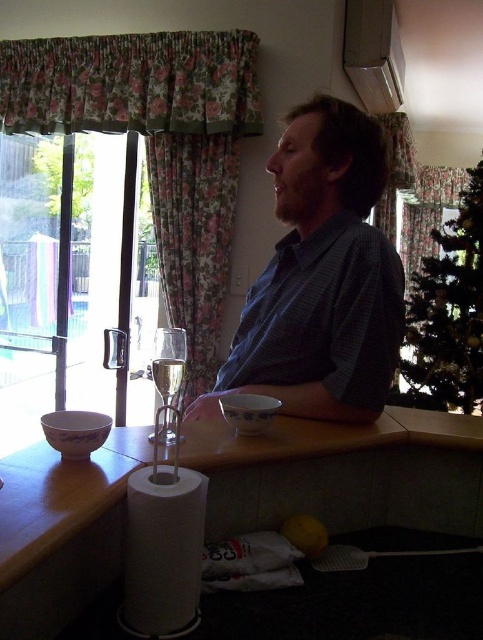
You are a delivery person standing at the entrance of the kitchen. You need to hand over a package to the man seated at the wooden counter. The package is too large to place on the counter. You have to decide whether to leave it by the transparent glass door at left or next to the man. Which location is closer to the man?

The transparent glass door at left is 2.89 meters away from the man. Since the package is too large for the counter, you should leave it next to the man because the distance between them is 2.89 meters, which is farther than leaving it by the transparent glass door at left. Wait, actually, the description says they are 2.89 meters apart. Hmm, maybe I need to clarify. The man is seated at the counter, and the door is at the left. The objects description states that they are 2.89 meters apart. So the distance

Based on the photo, you are a delivery person trying to enter the kitchen through the transparent glass door at left. The clear glass champagne flute at center is blocking your path. Can you pass through the door without moving the flute?

The transparent glass door at left is wider than the clear glass champagne flute at center, so yes, you can pass through the door without moving the flute since the door is wider than the object blocking the path.

You are a bartender preparing a drink station. You have a white paper towel at lower left and a clear glass champagne flute at center. The distance between them is crucial for efficiency. Can a 20 cm long tool like a tray be placed between them without moving either item?

The distance between the white paper towel at lower left and the clear glass champagne flute at center is 19.36 centimeters. Since the tool is 20 cm long, it cannot fit between them without overlapping either item.